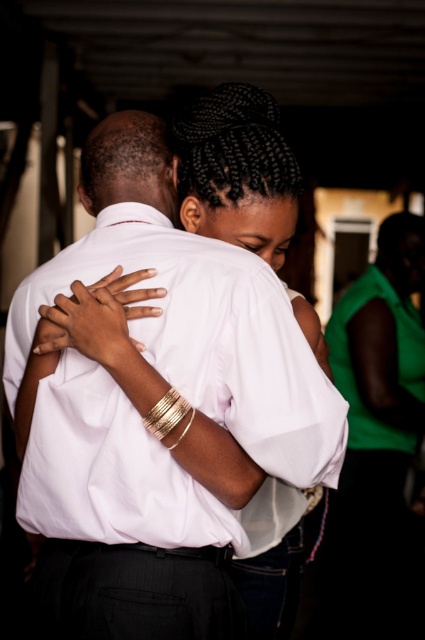
Question: Does white smooth shirt at center lie in front of white matte dress at center?

Choices:
 (A) yes
 (B) no

Answer: (A)

Question: Which of the following is the closest to the observer?

Choices:
 (A) coord(350,412)
 (B) coord(269,346)

Answer: (B)

Question: Can you confirm if white smooth shirt at center is thinner than white matte dress at center?

Choices:
 (A) no
 (B) yes

Answer: (A)

Question: Which point appears farthest from the camera in this image?

Choices:
 (A) (6, 396)
 (B) (374, 419)

Answer: (B)

Question: Does white smooth shirt at center have a greater width compared to white matte dress at center?

Choices:
 (A) yes
 (B) no

Answer: (A)